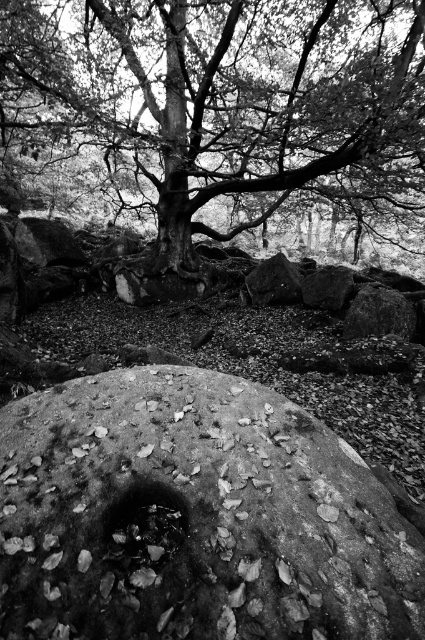
Does rough textured rock at center come behind smooth bark tree trunk at center?

No, it is in front of smooth bark tree trunk at center.

Does rough textured rock at center appear on the left side of smooth bark tree trunk at center?

No, rough textured rock at center is not to the left of smooth bark tree trunk at center.

Does point (147, 572) lie behind point (169, 212)?

No, (147, 572) is in front of (169, 212).

Locate an element on the screen. This screenshot has width=425, height=640. rough textured rock at center is located at coordinates (195, 516).

Does rough textured rock at center come behind smooth bark tree at center?

No.

Is rough textured rock at center positioned before smooth bark tree at center?

That is True.

Locate an element on the screen. rough textured rock at center is located at coordinates (195, 516).

Can you confirm if smooth bark tree at center is shorter than smooth bark tree trunk at center?

No, smooth bark tree at center is not shorter than smooth bark tree trunk at center.

Between point (235, 170) and point (169, 90), which one is positioned behind?

The point (235, 170) is behind.

The image size is (425, 640). Find the location of `smooth bark tree at center`. smooth bark tree at center is located at coordinates (226, 96).